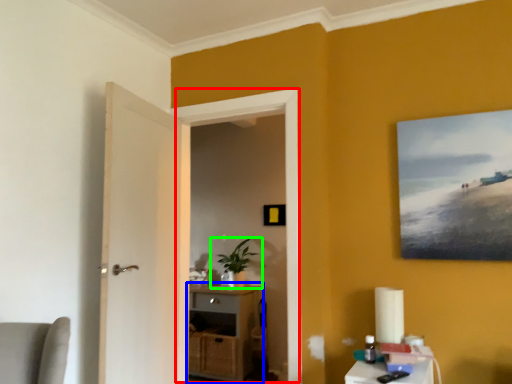
Question: Which object is positioned closest to window (highlighted by a red box)? Select from cabinetry (highlighted by a blue box) and houseplant (highlighted by a green box).

Choices:
 (A) cabinetry
 (B) houseplant

Answer: (A)